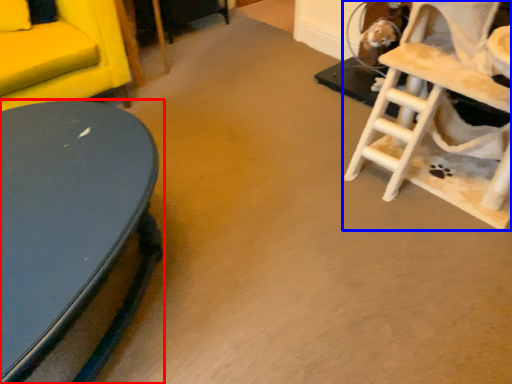
Question: Which point is closer to the camera, table (highlighted by a red box) or rocking chair (highlighted by a blue box)?

Choices:
 (A) table
 (B) rocking chair

Answer: (A)